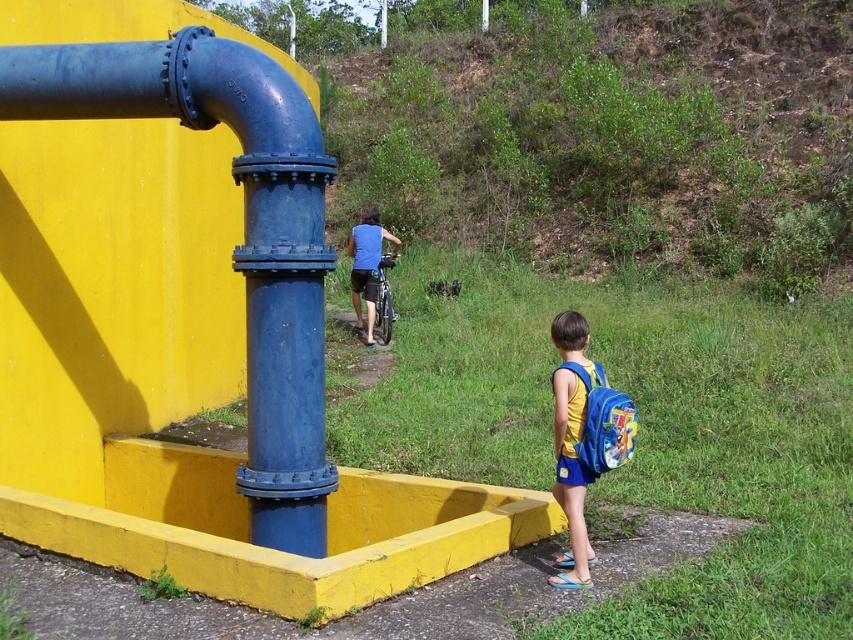
You are a delivery person who needs to place a package on the ground near the blue fabric backpack at center. What are the coordinates where you should place the package?

The coordinates to place the package near the blue fabric backpack at center are at point (570,476).

You are standing in front of the yellow wall with the blue pipe. There are two points marked on the wall at coordinates point (556,500) and point (370,339). Which point is closer to your eyes?

Point (556,500) is closer to the viewer than point (370,339).